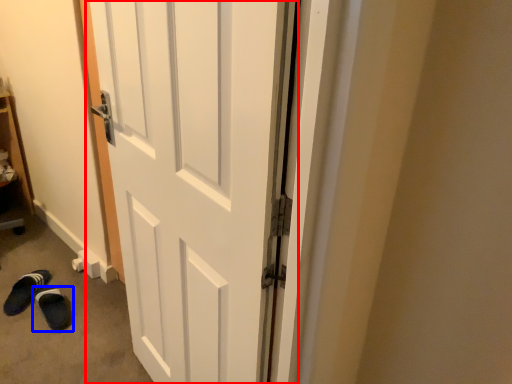
Question: Which of the following is the farthest to the observer, door (highlighted by a red box) or footwear (highlighted by a blue box)?

Choices:
 (A) door
 (B) footwear

Answer: (B)